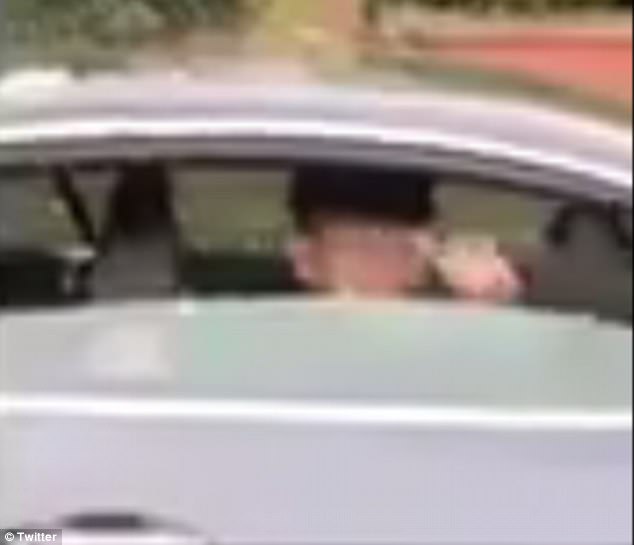
You are a GUI agent. You are given a task and a screenshot of the screen. Output one action in this format:
    pyautogui.click(x=<x>, y=<y>)
    Task: Click on the wall
    Image resolution: width=634 pixels, height=545 pixels.
    Given the screenshot: What is the action you would take?
    pyautogui.click(x=585, y=57)